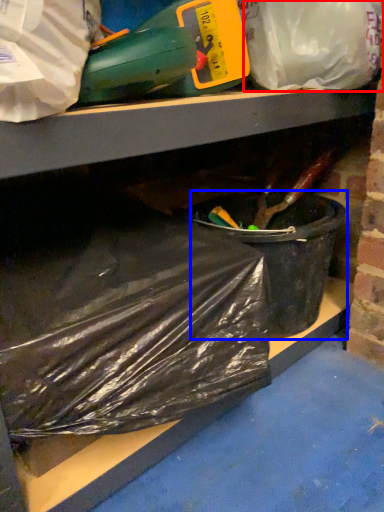
Question: Which object appears closest to the camera in this image, plastic bag (highlighted by a red box) or recycling bin (highlighted by a blue box)?

Choices:
 (A) plastic bag
 (B) recycling bin

Answer: (A)